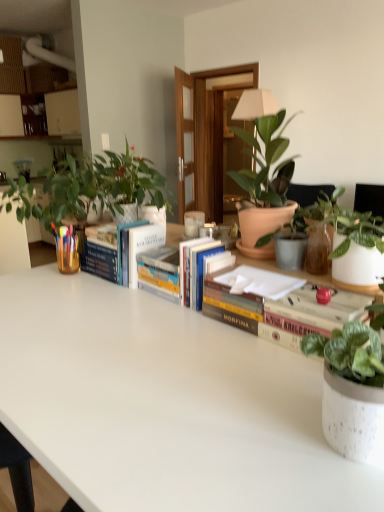
Question: From the image's perspective, would you say speckled white pot at upper right, the first houseplant positioned from the right, is shown under white matte table at center?

Choices:
 (A) no
 (B) yes

Answer: (A)

Question: Is speckled white pot at upper right, the first houseplant positioned from the right, wider than white matte table at center?

Choices:
 (A) no
 (B) yes

Answer: (A)

Question: Can you confirm if speckled white pot at upper right, the 6th houseplant from the left, is shorter than white matte table at center?

Choices:
 (A) no
 (B) yes

Answer: (B)

Question: Is speckled white pot at upper right, the 6th houseplant from the left, further to the viewer compared to white matte table at center?

Choices:
 (A) yes
 (B) no

Answer: (A)

Question: Does speckled white pot at upper right, the 6th houseplant from the left, appear on the left side of white matte table at center?

Choices:
 (A) yes
 (B) no

Answer: (B)

Question: Does point (291, 195) appear closer or farther from the camera than point (276, 287)?

Choices:
 (A) closer
 (B) farther

Answer: (B)

Question: Considering their positions, is terracotta pot at center, positioned as the third houseplant in right-to-left order, located in front of or behind white matte paper at center, which appears as the 1th paperback book when viewed from the right?

Choices:
 (A) front
 (B) behind

Answer: (B)

Question: Considering the positions of terracotta pot at center, positioned as the third houseplant in right-to-left order, and white matte paper at center, the second paperback book when ordered from back to front, in the image, is terracotta pot at center, positioned as the third houseplant in right-to-left order, wider or thinner than white matte paper at center, the second paperback book when ordered from back to front,?

Choices:
 (A) thin
 (B) wide

Answer: (A)

Question: Would you say terracotta pot at center, positioned as the third houseplant in right-to-left order, is inside or outside white matte paper at center, which appears as the 1th paperback book when viewed from the right?

Choices:
 (A) inside
 (B) outside

Answer: (B)

Question: Relative to speckled ceramic pot at lower right, the 2th houseplant positioned from the right, is hardcover books at center, marked as the 2th book in a left-to-right arrangement, in front or behind?

Choices:
 (A) behind
 (B) front

Answer: (A)

Question: From the image's perspective, is hardcover books at center, marked as the 2th book in a left-to-right arrangement, located above or below speckled ceramic pot at lower right, which ranks as the 5th houseplant in left-to-right order?

Choices:
 (A) below
 (B) above

Answer: (B)

Question: Is hardcover books at center, acting as the 2th book starting from the right, bigger or smaller than speckled ceramic pot at lower right, which ranks as the 5th houseplant in left-to-right order?

Choices:
 (A) small
 (B) big

Answer: (A)

Question: In the image, is hardcover books at center, acting as the 2th book starting from the right, on the left side or the right side of speckled ceramic pot at lower right, the 2th houseplant positioned from the right?

Choices:
 (A) left
 (B) right

Answer: (A)

Question: Is terracotta pot plant at center, the 3th houseplant when ordered from left to right, taller or shorter than speckled ceramic pot at lower right, which ranks as the 5th houseplant in left-to-right order?

Choices:
 (A) short
 (B) tall

Answer: (B)

Question: From a real-world perspective, relative to speckled ceramic pot at lower right, the 2th houseplant positioned from the right, is terracotta pot plant at center, which is counted as the 4th houseplant, starting from the right, vertically above or below?

Choices:
 (A) below
 (B) above

Answer: (B)